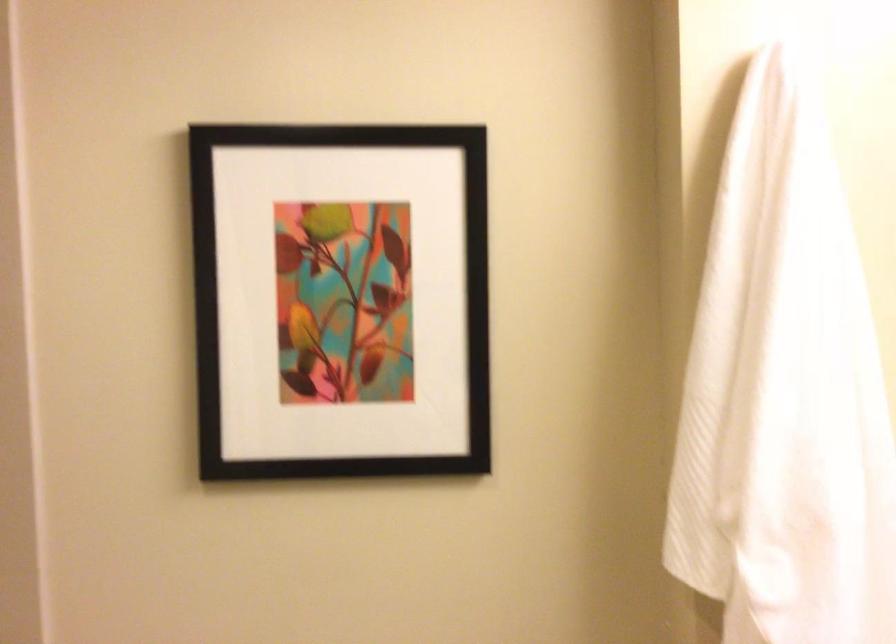
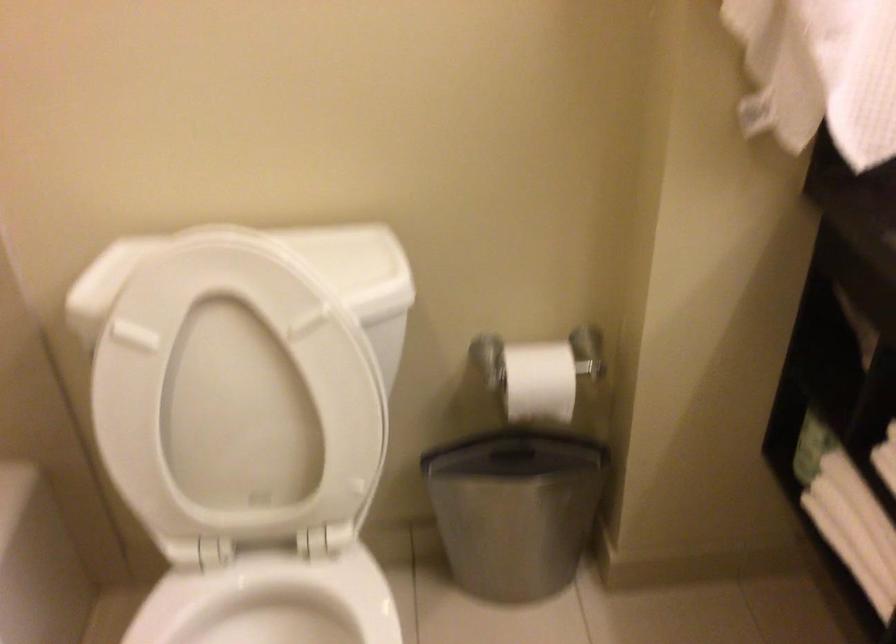
Question: Based on the continuous images, in which direction is the camera rotating? Reply with the corresponding letter.

Choices:
 (A) Left
 (B) Right
 (C) Up
 (D) Down

Answer: (D)